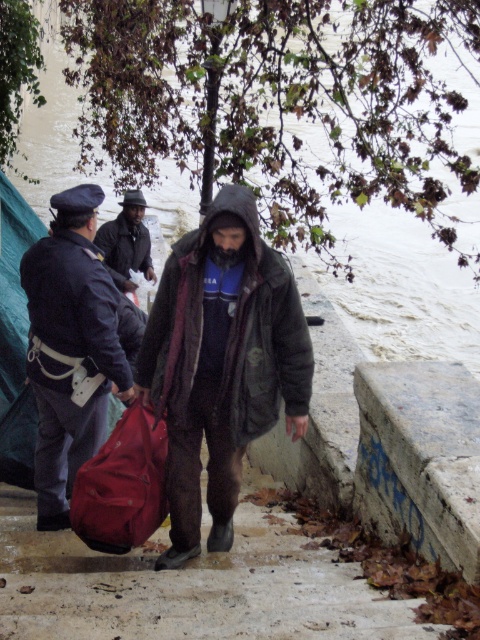
You are standing at the bottom of the staircase looking up. There are two points marked on the steps. Which point, point (56, 310) or point (22, 387), is closer to you?

Point (56, 310) is closer to the camera than point (22, 387), so it is closer to you.